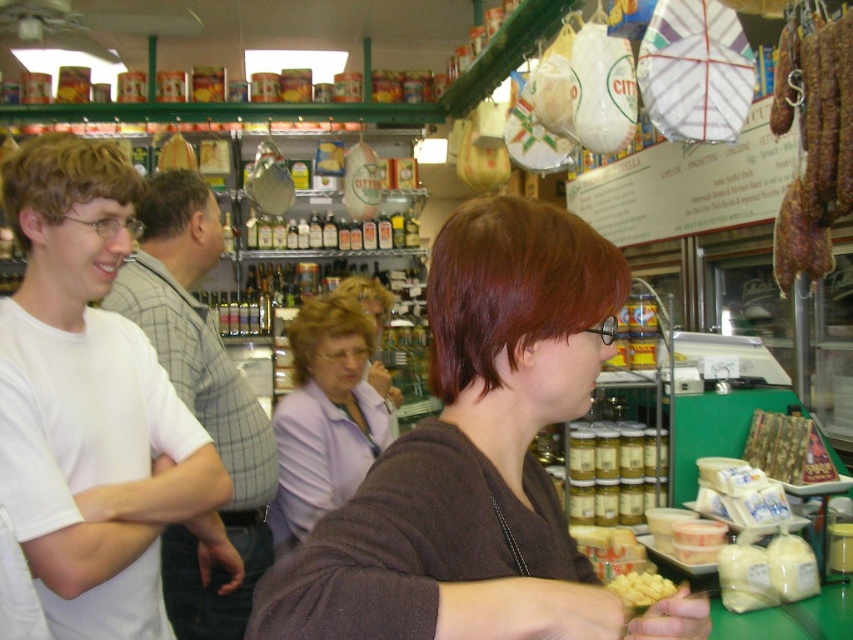
You are standing in the grocery store and want to reach both the point at coordinates point [256,572] and the point at coordinates point [781,54]. Which point will you reach first?

You will reach point [256,572] first because it is closer to you than point [781,54], which is further away.

You are a delivery person who needs to hand a package to the person wearing the purple fabric shirt at center. You are currently standing 10 feet away from them. Can you reach them without moving closer?

The purple fabric shirt at center is 6.55 feet away from the camera, so since you are 10 feet away, you need to move closer to reach them.